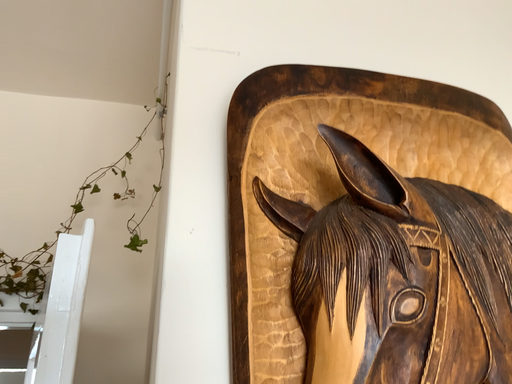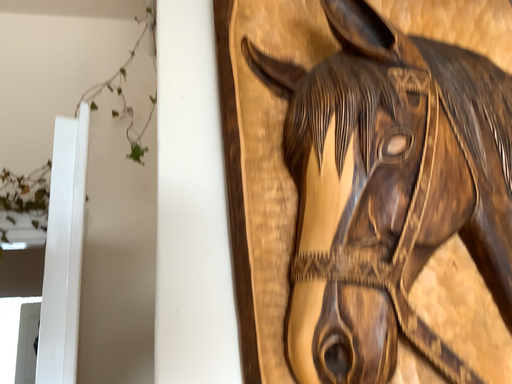
Question: Which way did the camera rotate in the video?

Choices:
 (A) rotated downward
 (B) rotated upward

Answer: (A)